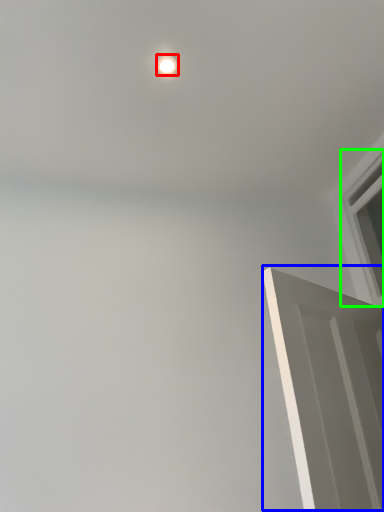
Question: Which object is positioned farthest from lighting (highlighted by a red box)? Select from door (highlighted by a blue box) and window (highlighted by a green box).

Choices:
 (A) door
 (B) window

Answer: (B)